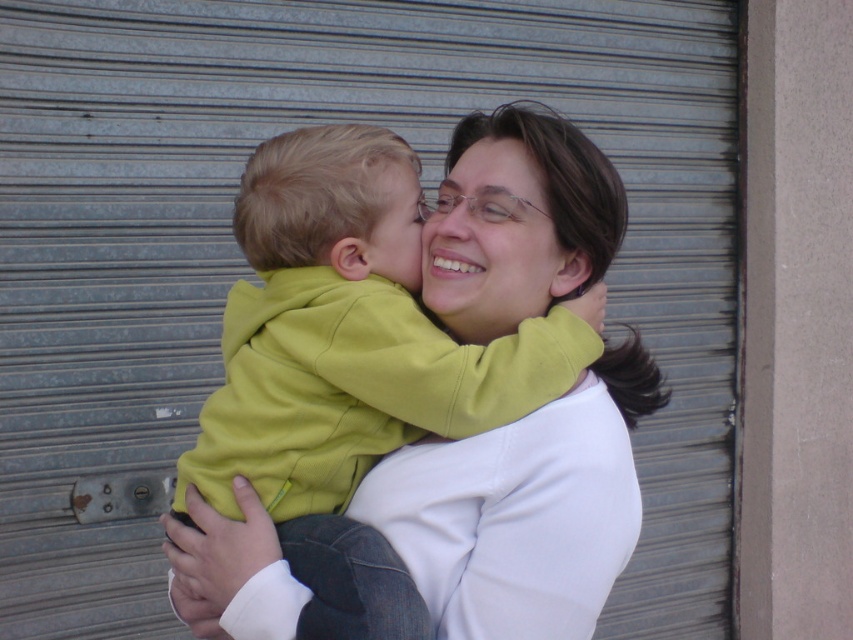
Can you confirm if matte yellow face at center is bigger than matte green hoodie at center?

Indeed, matte yellow face at center has a larger size compared to matte green hoodie at center.

Who is more distant from viewer, (x=485, y=163) or (x=396, y=216)?

Positioned behind is point (x=485, y=163).

This screenshot has width=853, height=640. Identify the location of matte yellow face at center. (486, 266).

Can you confirm if green fleece jacket at center is positioned to the left of matte yellow face at center?

Yes, green fleece jacket at center is to the left of matte yellow face at center.

Is green fleece jacket at center below matte yellow face at center?

Yes, green fleece jacket at center is below matte yellow face at center.

The image size is (853, 640). Describe the element at coordinates (347, 374) in the screenshot. I see `green fleece jacket at center` at that location.

What are the coordinates of `green fleece jacket at center` in the screenshot? It's located at (347, 374).

Does green fleece jacket at center lie behind matte green hoodie at center?

That is False.

Locate an element on the screen. The image size is (853, 640). green fleece jacket at center is located at coordinates (347, 374).